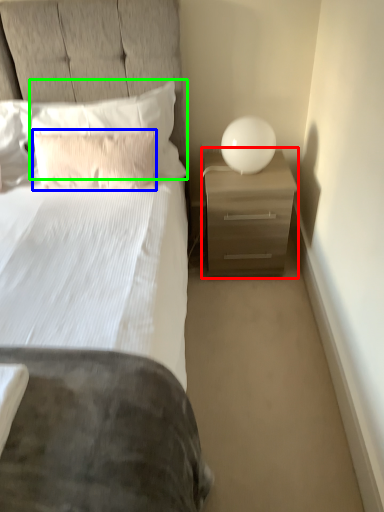
Question: Which object is positioned closest to nightstand (highlighted by a red box)? Select from pillow (highlighted by a blue box) and pillow (highlighted by a green box).

Choices:
 (A) pillow
 (B) pillow

Answer: (B)